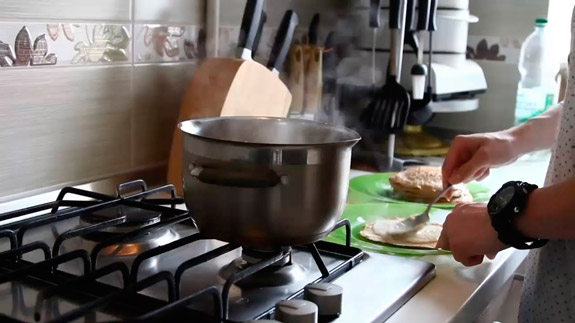
The image size is (575, 323). Identify the location of kitchen counter. (450, 277).